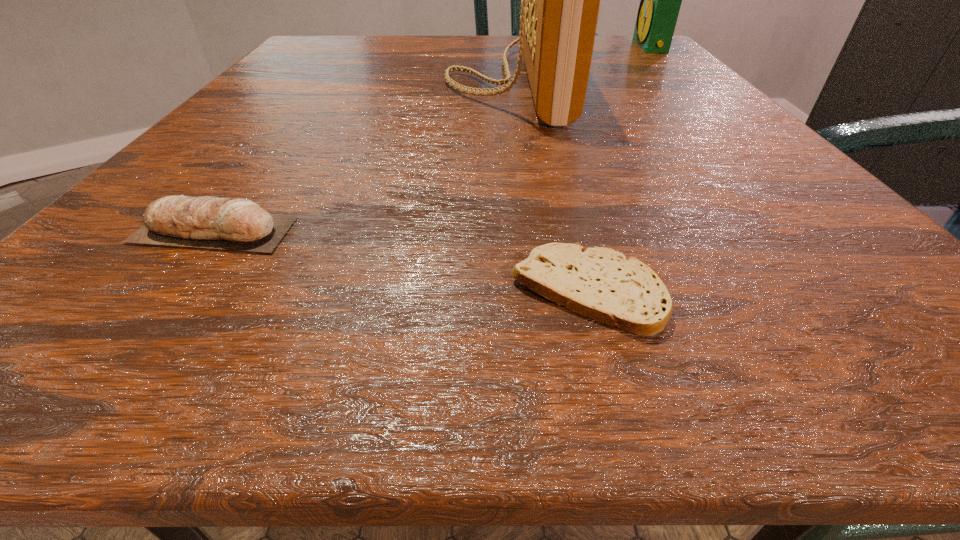
Where is `handbag`? The width and height of the screenshot is (960, 540). handbag is located at coordinates (560, 0).

Find the location of a particular element. The width and height of the screenshot is (960, 540). the rightmost object is located at coordinates (660, 0).

At what (x,y) coordinates should I click in order to perform the action: click on alarm clock. Please return your answer as a coordinate pair (x, y). This screenshot has height=540, width=960. Looking at the image, I should click on (660, 0).

Identify the location of the taller pita bread. (239, 224).

At what (x,y) coordinates should I click in order to perform the action: click on the leftmost object. Please return your answer as a coordinate pair (x, y). Image resolution: width=960 pixels, height=540 pixels. Looking at the image, I should click on (239, 224).

I want to click on the right pita bread, so click(600, 283).

Find the location of a particular element. the shortest object is located at coordinates (600, 283).

The height and width of the screenshot is (540, 960). I want to click on vacant area situated 0.100m on the decorative side of the handbag, so click(x=390, y=81).

The image size is (960, 540). I want to click on vacant region located 0.090m on the decorative side of the handbag, so click(x=396, y=81).

Locate an element on the screen. free space located on the decorative side of the handbag is located at coordinates (319, 81).